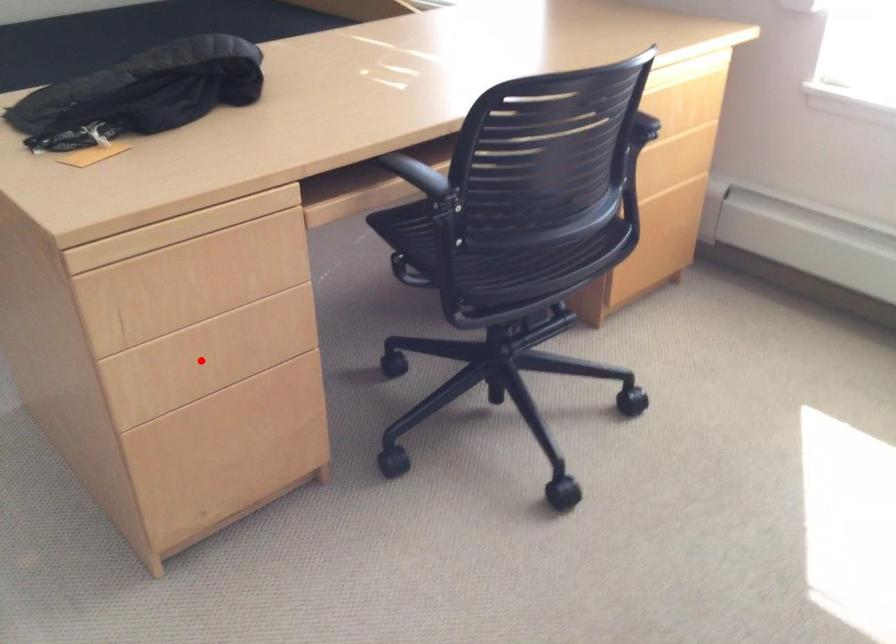
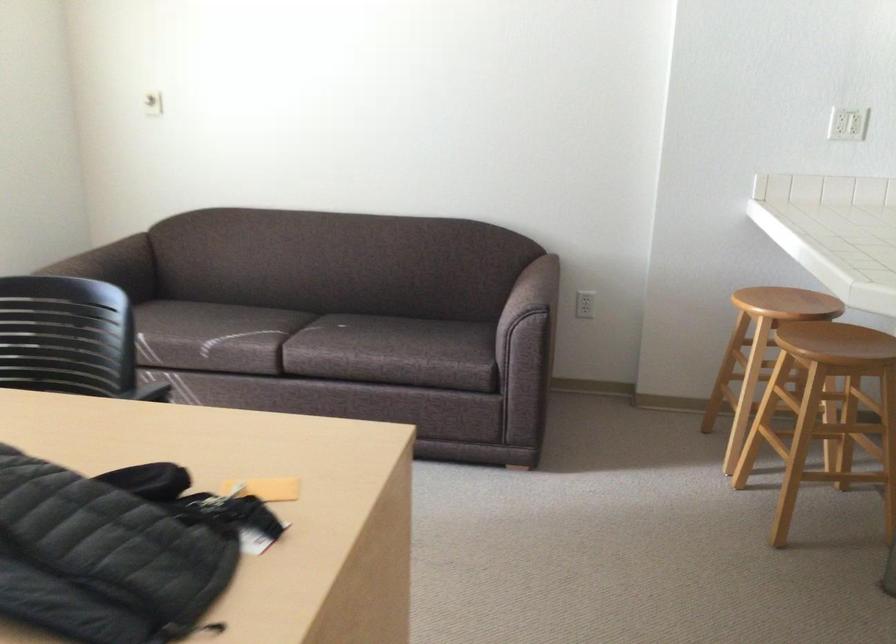
Question: I am providing you with two images of the same scene from different viewpoints. A red point is marked on the first image. At the location where the point appears in image 1, is it still visible in image 2?

Choices:
 (A) Yes
 (B) No

Answer: (B)